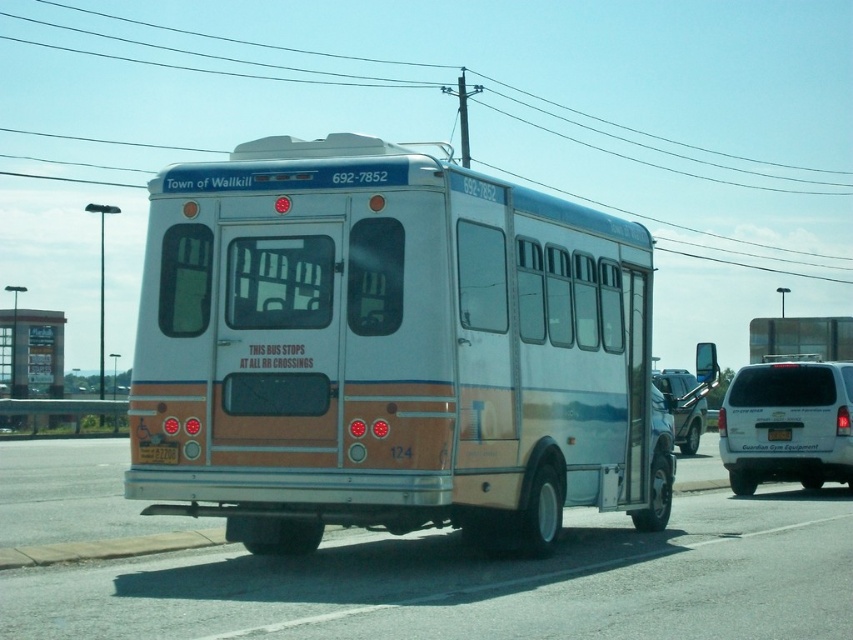
You are standing at the point marked by the coordinates (389, 349) on the image. What object are you directly facing?

The point at coordinates (389, 349) corresponds to the white metallic bus at center, so you are directly facing the white metallic bus at center.

You are a delivery person standing at the front of the bus. You need to load a package into the van. Where should you position yourself relative to the bus to reach the white matte van at right?

The white matte van at right is located at point (787,424), so you should position yourself at the right side of the bus to reach it.

You are a delivery person who needs to load a package onto the yellow plastic license plate at rear center of the white metallic bus at center. The package requires 5 feet of clearance from the bus to the license plate. Can you safely load the package?

The distance between the white metallic bus at center and the yellow plastic license plate at rear center is 5.36 feet, which is greater than the required 5 feet clearance. Therefore, you can safely load the package.